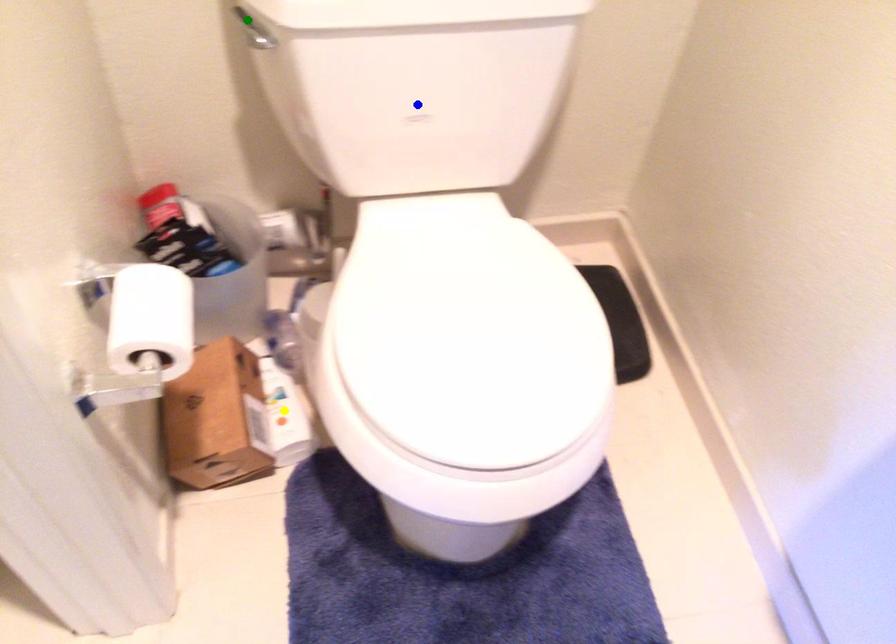
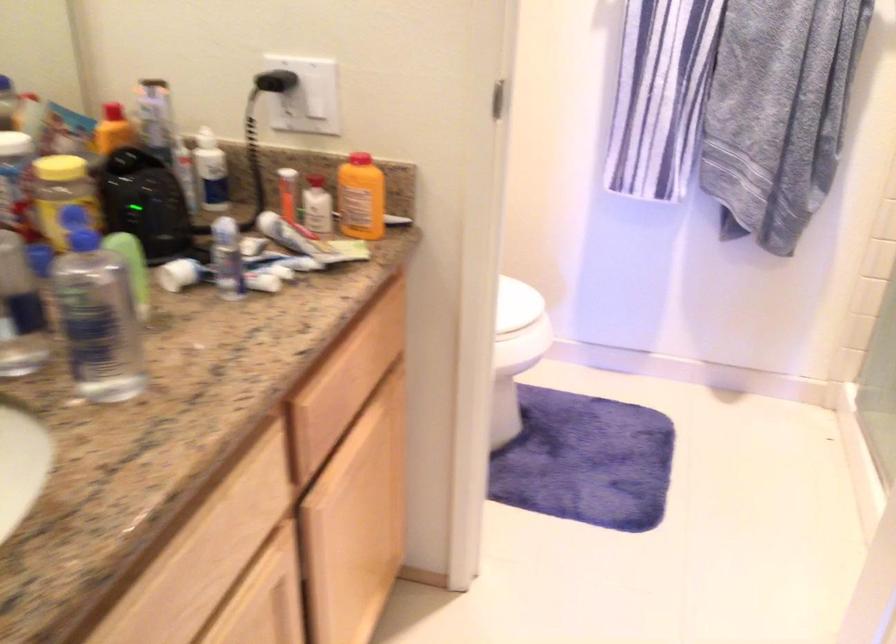
I am providing you with two images of the same scene from different viewpoints. Three points are marked in image1. Which point corresponds to a part or object that is occluded in image2?In image1, three points are marked. Which of them correspond to a part or object that is occluded in image2?Among the three points shown in image1, which one corresponds to a part or object that is no longer visible due to occlusion in image2?

Invisible in image2: blue point, yellow point, green point.